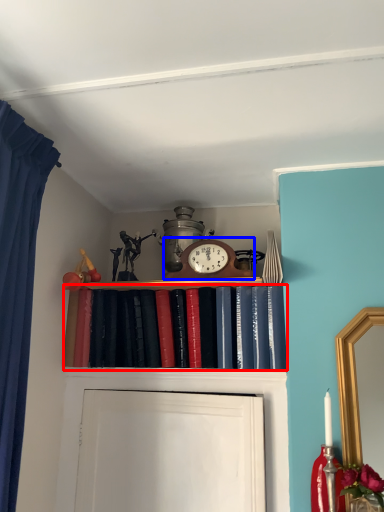
Question: Which object is further to the camera taking this photo, book (highlighted by a red box) or alarm clock (highlighted by a blue box)?

Choices:
 (A) book
 (B) alarm clock

Answer: (B)